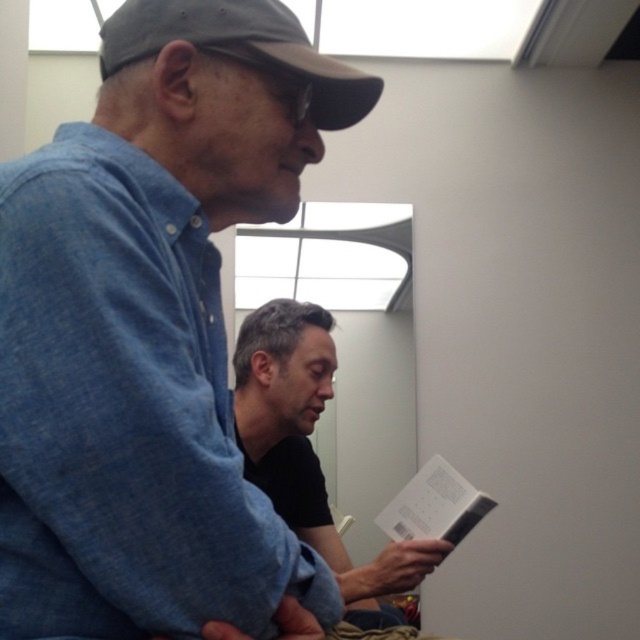
Between black matte book at center and white paper at lower center, which one is positioned lower?

Positioned lower is white paper at lower center.

Does black matte book at center have a lesser width compared to white paper at lower center?

No, black matte book at center is not thinner than white paper at lower center.

Measure the distance between point (x=253, y=422) and camera.

A distance of 4.63 feet exists between point (x=253, y=422) and camera.

Where is `black matte book at center`? The height and width of the screenshot is (640, 640). black matte book at center is located at coordinates (308, 451).

Does denim shirt at left have a larger size compared to black matte book at center?

Actually, denim shirt at left might be smaller than black matte book at center.

In order to click on denim shirt at left in this screenshot , I will do `click(150, 328)`.

Which is behind, point (241, 589) or point (385, 595)?

Point (385, 595)

Locate an element on the screen. The width and height of the screenshot is (640, 640). denim shirt at left is located at coordinates (150, 328).

Between black matte baseball cap at upper left and white paper at lower center, which one is positioned higher?

black matte baseball cap at upper left

Can you confirm if black matte baseball cap at upper left is positioned above white paper at lower center?

Yes.

Does point (221, 16) come behind point (465, 493)?

That is False.

Identify the location of black matte baseball cap at upper left. Image resolution: width=640 pixels, height=640 pixels. (241, 49).